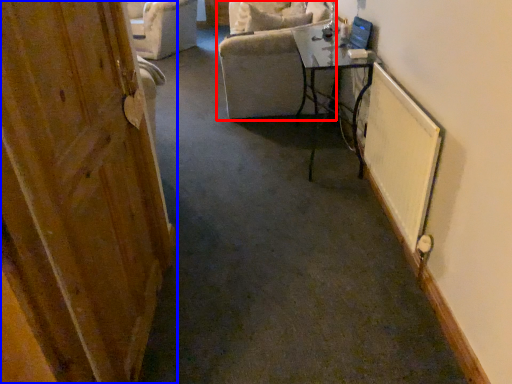
Question: Among these objects, which one is farthest to the camera, chair (highlighted by a red box) or door (highlighted by a blue box)?

Choices:
 (A) chair
 (B) door

Answer: (A)